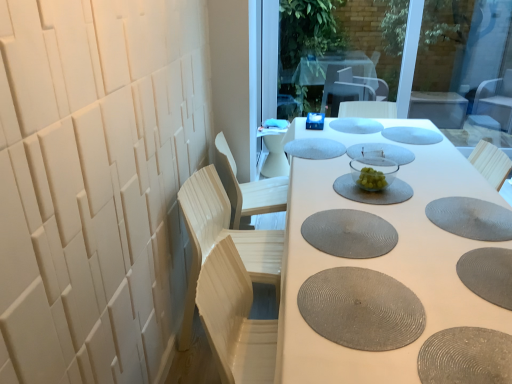
What are the coordinates of `vacant area that lies between gray textured placemat at lower right, the 6th manhole cover in the back-to-front sequence, and clear glass bowl at center, which is counted as the 5th manhole cover, starting from the back` in the screenshot? It's located at (415, 198).